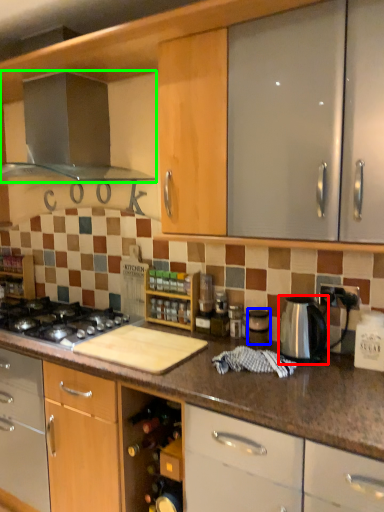
Question: Estimate the real-world distances between objects in this image. Which object is closer to kitchen appliance (highlighted by a red box), appliance (highlighted by a blue box) or kitchen appliance (highlighted by a green box)?

Choices:
 (A) appliance
 (B) kitchen appliance

Answer: (A)